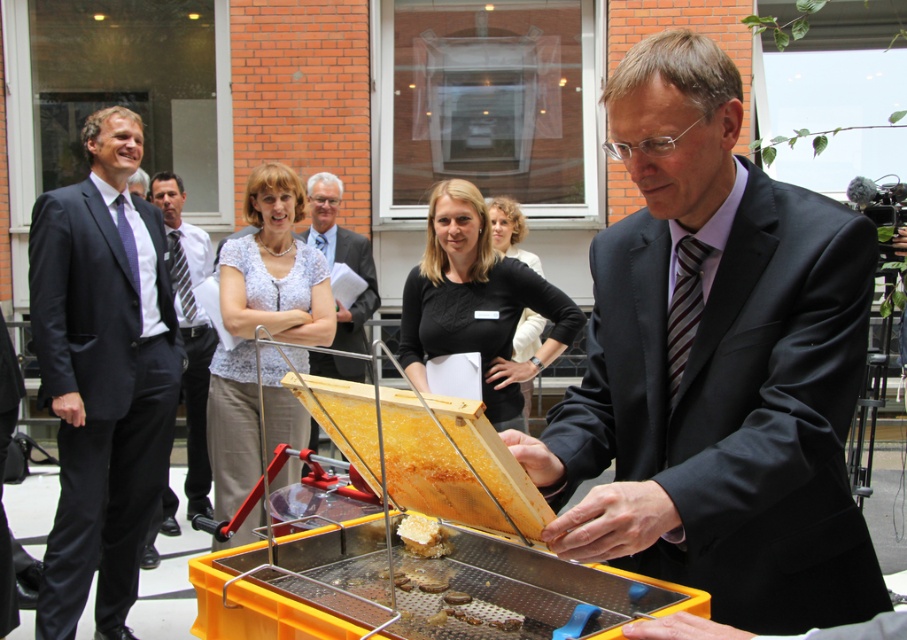
You are a photographer at the event. You need to capture a closeup of the yellow honeycomb at center without the black matte shirt at center blocking the view. Is this possible?

The black matte shirt at center is bigger than the yellow honeycomb at center, so it might block the view. Adjust your angle to avoid the shirt or move closer to ensure the shirt doesn

You are a photographer at the event and need to capture a closeup of both the black matte shirt at center and the dark gray suit at center. Since the camera can only focus on one subject at a time, which subject should you choose to ensure the other is still in focus due to their size difference?

The black matte shirt at center is wider than the dark gray suit at center. To keep both in focus, focus on the wider subject, the black matte shirt at center, as its larger size will help maintain focus on the narrower dark gray suit at center.

You are organizing a photoshoot and need to ensure that the dark gray suit at left and the black fabric shirt at center are visible in the frame. Given that the camera has a limited field of view, which subject should you prioritize to ensure both are in the frame without cropping?

The dark gray suit at left is wider than the black fabric shirt at center, so prioritizing the dark gray suit at left in the frame would ensure there is enough space for both subjects.